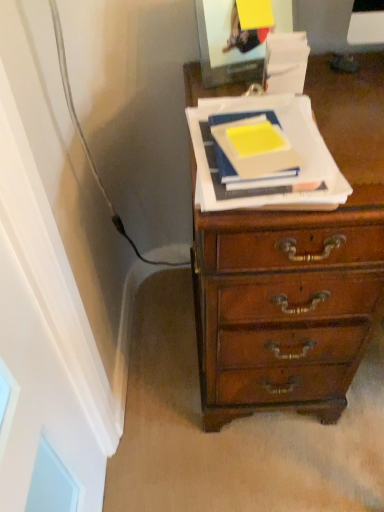
Question: Are yellow matte paper at center, the 2th paperback book from the right, and yellow matte paper at center, placed as the first paperback book when sorted from right to left, making contact?

Choices:
 (A) yes
 (B) no

Answer: (A)

Question: Can you confirm if yellow matte paper at center, which appears as the first paperback book when viewed from the left, is bigger than yellow matte paper at center, placed as the first paperback book when sorted from right to left?

Choices:
 (A) yes
 (B) no

Answer: (B)

Question: Is yellow matte paper at center, which appears as the first paperback book when viewed from the left, not near yellow matte paper at center, the second paperback book in the left-to-right sequence?

Choices:
 (A) no
 (B) yes

Answer: (A)

Question: Is yellow matte paper at center, the 2th paperback book from the right, to the right of yellow matte paper at center, placed as the first paperback book when sorted from right to left, from the viewer's perspective?

Choices:
 (A) no
 (B) yes

Answer: (A)

Question: Can you confirm if yellow matte paper at center, which appears as the first paperback book when viewed from the left, is shorter than yellow matte paper at center, placed as the first paperback book when sorted from right to left?

Choices:
 (A) yes
 (B) no

Answer: (B)

Question: From the image's perspective, is yellow matte paper at center, the 2th paperback book from the right, located above yellow matte paper at center, placed as the first paperback book when sorted from right to left?

Choices:
 (A) yes
 (B) no

Answer: (A)

Question: Does yellow matte paper at center, the second paperback book in the left-to-right sequence, have a greater height compared to yellow matte paper at center, which appears as the first paperback book when viewed from the left?

Choices:
 (A) no
 (B) yes

Answer: (A)

Question: Is yellow matte paper at center, the second paperback book in the left-to-right sequence, behind yellow matte paper at center, the 2th paperback book from the right?

Choices:
 (A) no
 (B) yes

Answer: (A)

Question: Is the position of yellow matte paper at center, the second paperback book in the left-to-right sequence, less distant than that of yellow matte paper at center, which appears as the first paperback book when viewed from the left?

Choices:
 (A) yes
 (B) no

Answer: (A)

Question: Is yellow matte paper at center, the second paperback book in the left-to-right sequence, not near yellow matte paper at center, which appears as the first paperback book when viewed from the left?

Choices:
 (A) yes
 (B) no

Answer: (B)

Question: From the image's perspective, would you say yellow matte paper at center, placed as the first paperback book when sorted from right to left, is shown under yellow matte paper at center, the 2th paperback book from the right?

Choices:
 (A) no
 (B) yes

Answer: (B)

Question: Considering the relative sizes of yellow matte paper at center, the second paperback book in the left-to-right sequence, and yellow matte paper at center, which appears as the first paperback book when viewed from the left, in the image provided, is yellow matte paper at center, the second paperback book in the left-to-right sequence, thinner than yellow matte paper at center, which appears as the first paperback book when viewed from the left,?

Choices:
 (A) yes
 (B) no

Answer: (B)

Question: From the image's perspective, is yellow matte paper at center, the 2th paperback book from the right, positioned above or below yellow matte paper at center, the second paperback book in the left-to-right sequence?

Choices:
 (A) below
 (B) above

Answer: (B)